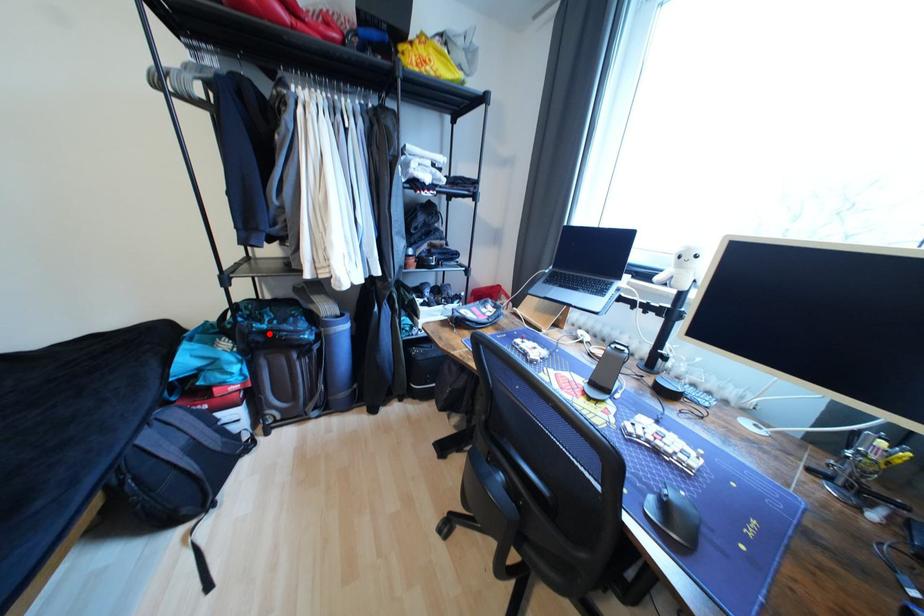
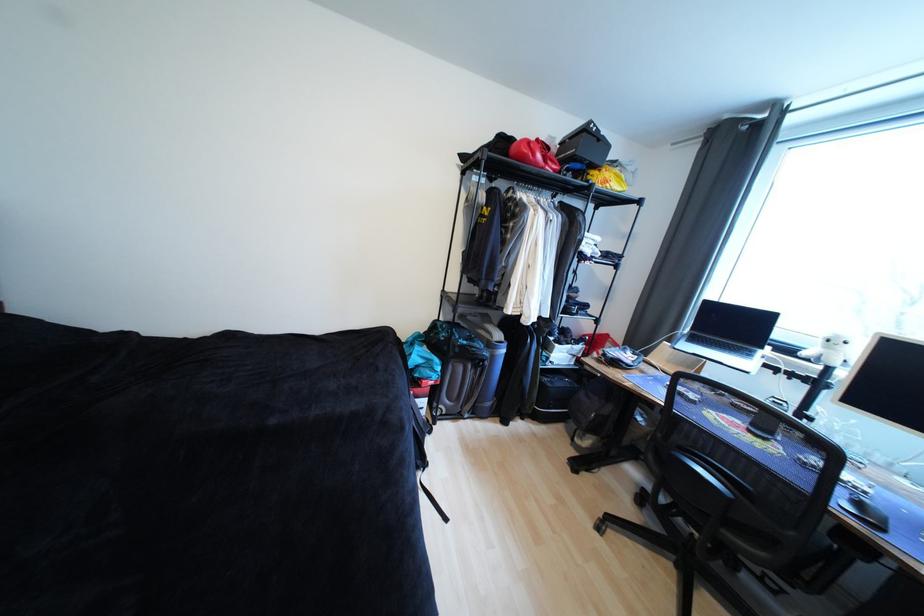
Locate, in the second image, the point that corresponds to the highlighted location in the first image.

(469, 347)